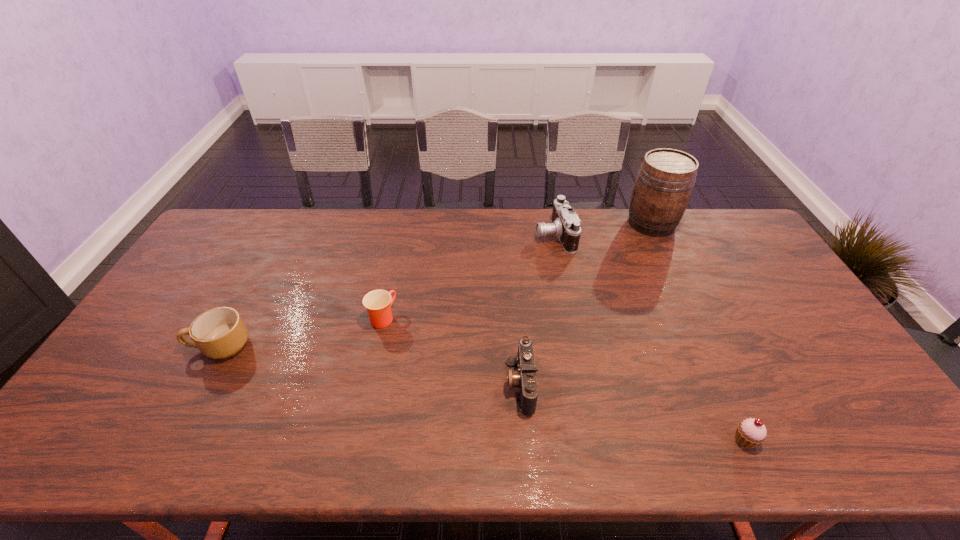
This screenshot has width=960, height=540. Identify the location of vacant space located on the side of the tallest object near the bung hole. (565, 224).

Image resolution: width=960 pixels, height=540 pixels. Find the location of `vacant region located at the lens of the right camera`. vacant region located at the lens of the right camera is located at coordinates (498, 235).

The height and width of the screenshot is (540, 960). Identify the location of vacant space located at the lens of the right camera. (476, 235).

The image size is (960, 540). Identify the location of vacant space located 0.300m at the lens of the right camera. click(451, 235).

The image size is (960, 540). Identify the location of vacant space located 0.150m on the side with the handle of the leftmost object. (136, 346).

Find the location of a particular element. This screenshot has height=540, width=960. free location located on the side with the handle of the leftmost object is located at coordinates (144, 346).

This screenshot has width=960, height=540. Find the location of `vacant space situated on the front-facing side of the nearer camera`. vacant space situated on the front-facing side of the nearer camera is located at coordinates (358, 383).

Locate an element on the screen. The height and width of the screenshot is (540, 960). free space located on the front-facing side of the nearer camera is located at coordinates (390, 383).

Where is `free location located 0.090m on the front-facing side of the nearer camera`? free location located 0.090m on the front-facing side of the nearer camera is located at coordinates (471, 383).

Identify the location of free location located 0.060m on the right of the fifth object from right to left. The width and height of the screenshot is (960, 540). (417, 318).